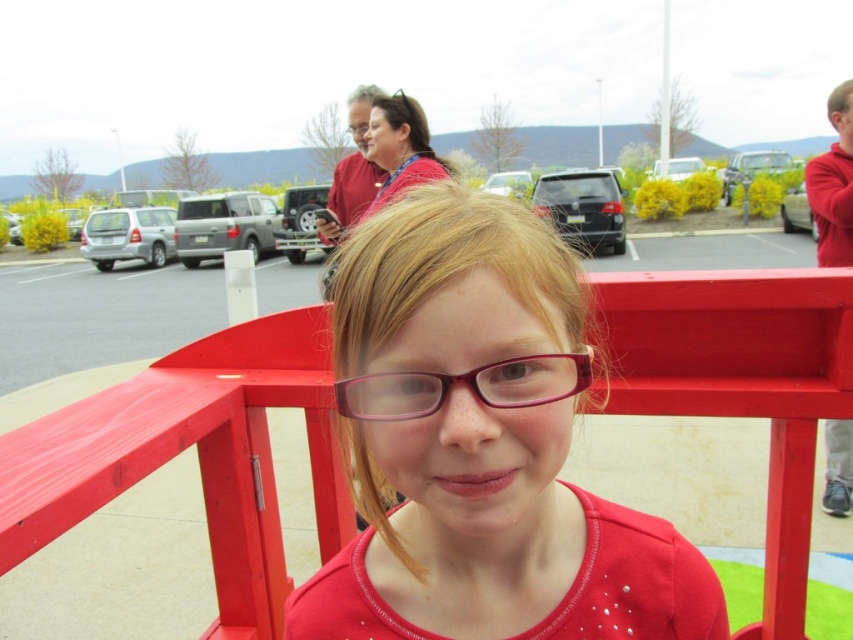
Question: Is matte plastic glasses at center wider than matte plastic rail at center?

Choices:
 (A) no
 (B) yes

Answer: (A)

Question: Which point is farther from the camera taking this photo?

Choices:
 (A) (363, 396)
 (B) (548, 298)

Answer: (A)

Question: Which point appears closest to the camera in this image?

Choices:
 (A) click(422, 403)
 (B) click(120, 484)
 (C) click(503, 604)

Answer: (A)

Question: Is matte plastic glasses at center positioned behind matte plastic rail at center?

Choices:
 (A) yes
 (B) no

Answer: (B)

Question: Which object is positioned farthest from the matte plastic rail at center?

Choices:
 (A) matte plastic glasses at center
 (B) pink plastic glasses at center

Answer: (B)

Question: Can you confirm if matte plastic glasses at center is smaller than matte plastic rail at center?

Choices:
 (A) no
 (B) yes

Answer: (B)